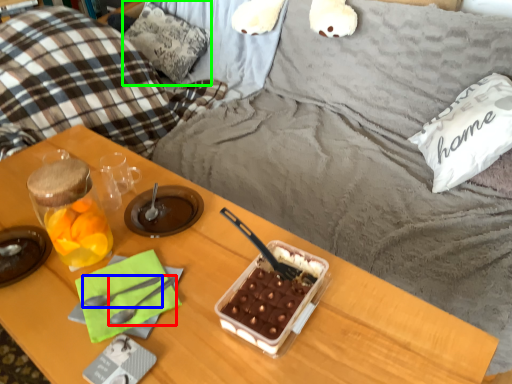
Question: Which is nearer to the spoon (highlighted by a red box)? spoon (highlighted by a blue box) or pillow (highlighted by a green box).

Choices:
 (A) spoon
 (B) pillow

Answer: (A)